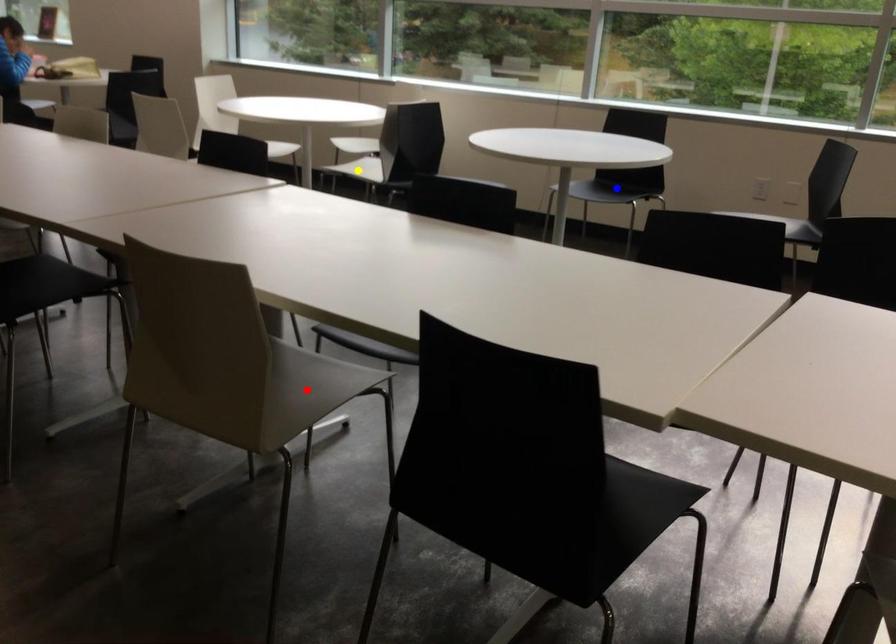
Order these from farthest to nearest:
- yellow point
- blue point
- red point

yellow point
blue point
red point